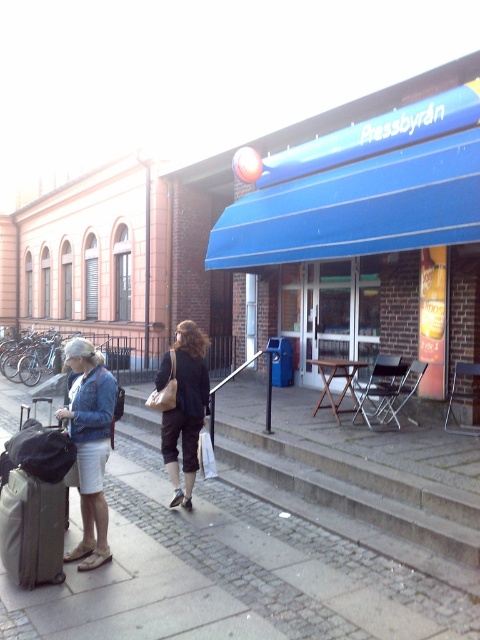
Can you confirm if blue awning at center is positioned to the left of matte gray suitcase at lower left?

Incorrect, blue awning at center is not on the left side of matte gray suitcase at lower left.

Is blue awning at center behind matte gray suitcase at lower left?

Yes, it is behind matte gray suitcase at lower left.

Who is more forward, (196, 252) or (60, 545)?

Point (60, 545) is more forward.

Identify the location of blue awning at center. This screenshot has width=480, height=640. pyautogui.click(x=350, y=230).

Which is more to the left, cobblestone pavement at lower left or matte black pants at center?

matte black pants at center

Does cobblestone pavement at lower left have a smaller size compared to matte black pants at center?

Correct, cobblestone pavement at lower left occupies less space than matte black pants at center.

The width and height of the screenshot is (480, 640). What are the coordinates of `cobblestone pavement at lower left` in the screenshot? It's located at (230, 576).

Identify the location of cobblestone pavement at lower left. The image size is (480, 640). (230, 576).

Is blue awning at center smaller than denim jacket at left?

Incorrect, blue awning at center is not smaller in size than denim jacket at left.

What do you see at coordinates (350, 230) in the screenshot? The height and width of the screenshot is (640, 480). I see `blue awning at center` at bounding box center [350, 230].

Locate an element on the screen. The height and width of the screenshot is (640, 480). blue awning at center is located at coordinates (350, 230).